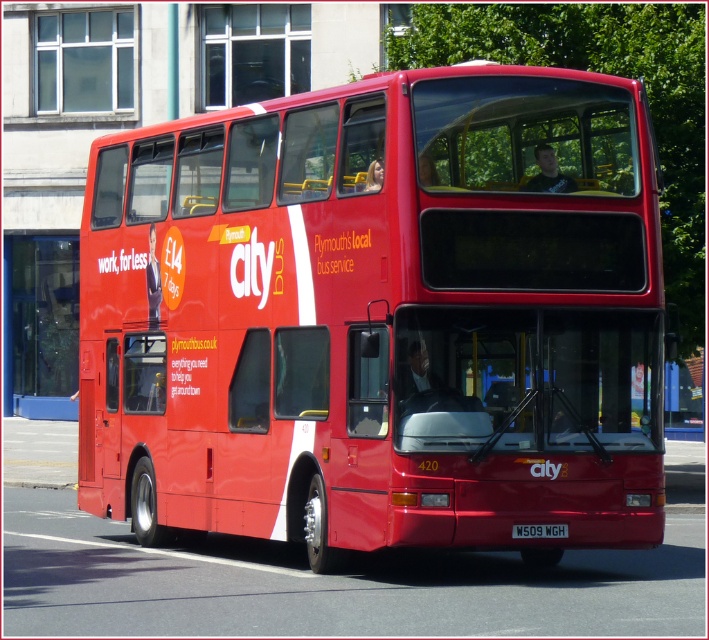
Question: Is shiny red bus at center in front of black plastic license plate at center?

Choices:
 (A) yes
 (B) no

Answer: (B)

Question: Is shiny red bus at center closer to the viewer compared to black plastic license plate at center?

Choices:
 (A) no
 (B) yes

Answer: (A)

Question: Which point is closer to the camera taking this photo?

Choices:
 (A) (515, 528)
 (B) (424, 486)

Answer: (B)

Question: Which point appears closest to the camera in this image?

Choices:
 (A) (558, 531)
 (B) (580, 141)

Answer: (A)

Question: Can you confirm if shiny red bus at center is positioned above black plastic license plate at center?

Choices:
 (A) no
 (B) yes

Answer: (B)